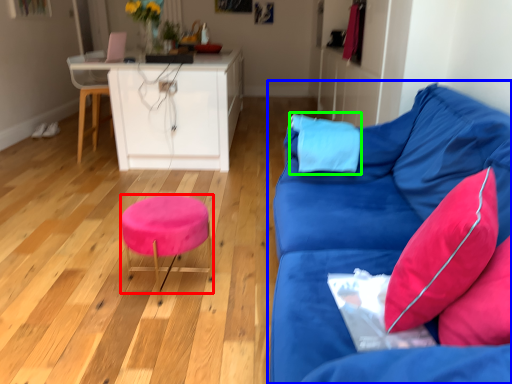
Question: Estimate the real-world distances between objects in this image. Which object is closer to stool (highlighted by a red box), studio couch (highlighted by a blue box) or pillow (highlighted by a green box)?

Choices:
 (A) studio couch
 (B) pillow

Answer: (A)